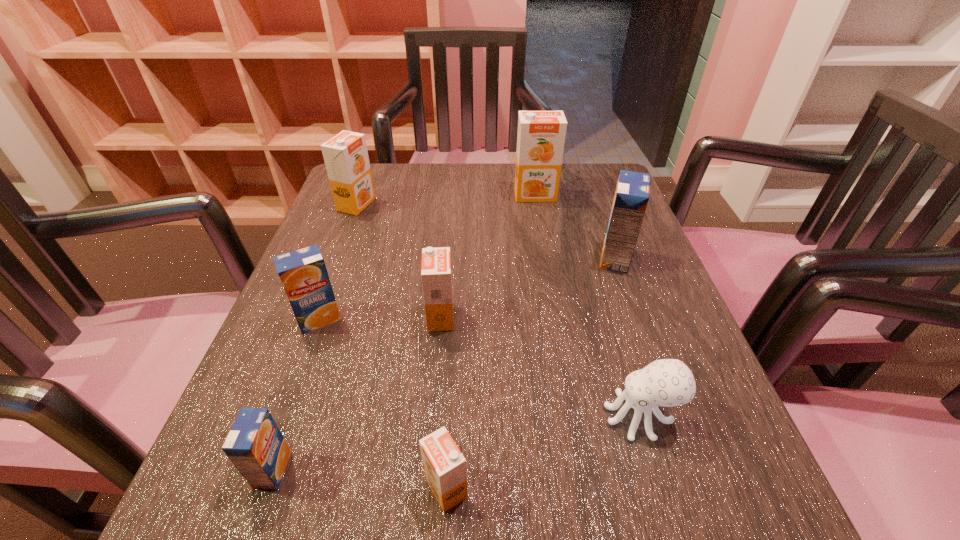
Where is `blank space that satisfies the following two spatial constraints: 1. on the front side of the second smallest blue orange_juice; 2. on the right side of the leftmost orange orange juice`? The image size is (960, 540). blank space that satisfies the following two spatial constraints: 1. on the front side of the second smallest blue orange_juice; 2. on the right side of the leftmost orange orange juice is located at coordinates (313, 319).

This screenshot has width=960, height=540. I want to click on free space that satisfies the following two spatial constraints: 1. on the back side of the nearest blue orange_juice; 2. on the right side of the tallest object, so click(x=369, y=195).